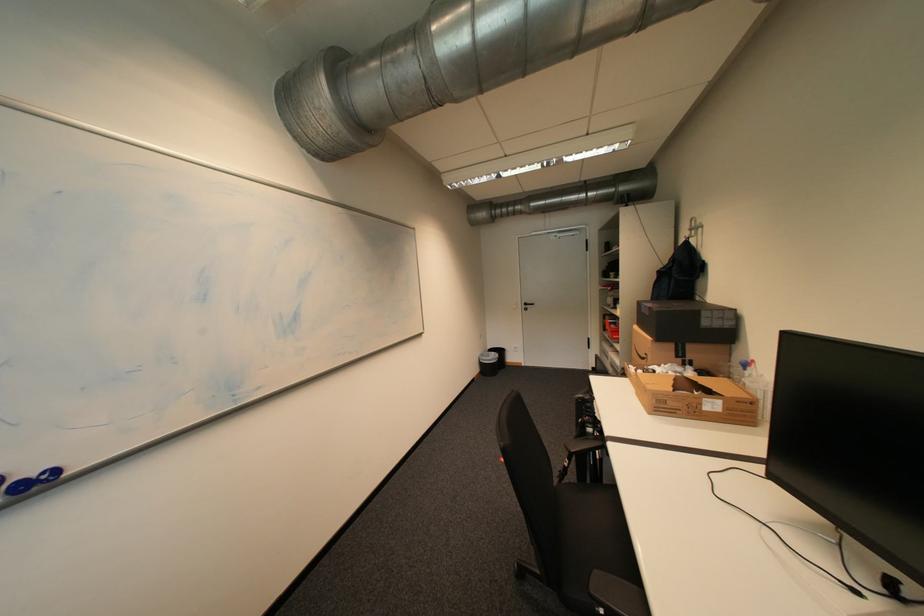
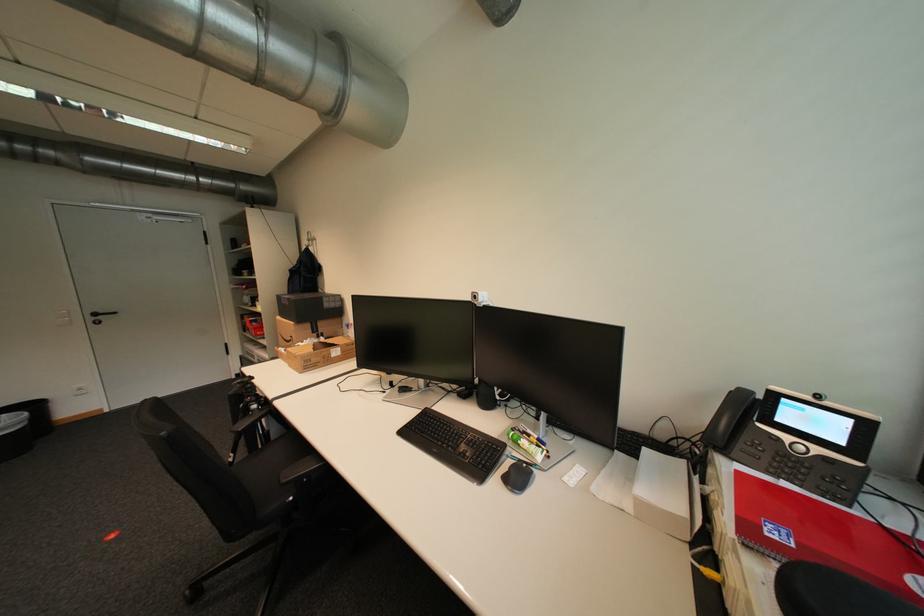
The point at (599, 370) is marked in the first image. Where is the corresponding point in the second image?

(242, 378)